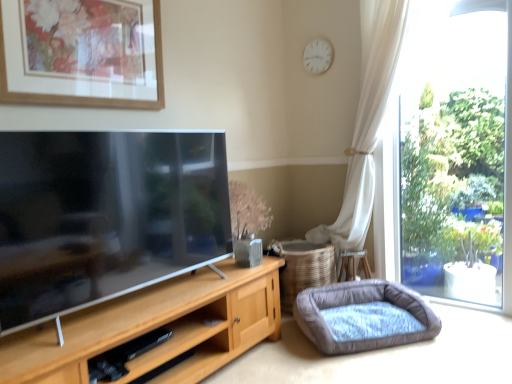
What do you see at coordinates (83, 96) in the screenshot? This screenshot has height=384, width=512. I see `matte wooden picture frame at upper left` at bounding box center [83, 96].

The image size is (512, 384). I want to click on white matte clock at upper center, so click(x=318, y=56).

Is point (37, 96) farther from viewer compared to point (316, 41)?

No, (37, 96) is closer to viewer.

How far apart are matte wooden picture frame at upper left and white matte clock at upper center?

A distance of 4.87 feet exists between matte wooden picture frame at upper left and white matte clock at upper center.

From the image's perspective, is matte wooden picture frame at upper left below white matte clock at upper center?

Correct, matte wooden picture frame at upper left appears lower than white matte clock at upper center in the image.

Does velvet grey dog bed at lower right touch white matte clock at upper center?

No, velvet grey dog bed at lower right is not next to white matte clock at upper center.

From a real-world perspective, which object rests below the other?

From a 3D spatial view, velvet grey dog bed at lower right is below.

From the image's perspective, is velvet grey dog bed at lower right located beneath white matte clock at upper center?

Yes, from the image's perspective, velvet grey dog bed at lower right is below white matte clock at upper center.

Can you confirm if white matte clock at upper center is wider than velvet grey dog bed at lower right?

No.

From the image's perspective, is white matte clock at upper center above velvet grey dog bed at lower right?

Indeed, from the image's perspective, white matte clock at upper center is shown above velvet grey dog bed at lower right.

Is white matte clock at upper center to the right of velvet grey dog bed at lower right from the viewer's perspective?

In fact, white matte clock at upper center is to the left of velvet grey dog bed at lower right.

From a real-world perspective, does white matte clock at upper center stand above velvet grey dog bed at lower right?

Indeed, from a real-world perspective, white matte clock at upper center stands above velvet grey dog bed at lower right.

Between white matte clock at upper center and matte wooden picture frame at upper left, which one appears on the left side from the viewer's perspective?

From the viewer's perspective, matte wooden picture frame at upper left appears more on the left side.

Can we say white matte clock at upper center lies outside matte wooden picture frame at upper left?

white matte clock at upper center is positioned outside matte wooden picture frame at upper left.

Is white matte clock at upper center wider or thinner than matte wooden picture frame at upper left?

Clearly, white matte clock at upper center has less width compared to matte wooden picture frame at upper left.

From the image's perspective, is velvet grey dog bed at lower right on matte wooden picture frame at upper left?

Actually, velvet grey dog bed at lower right appears below matte wooden picture frame at upper left in the image.

Considering the positions of objects velvet grey dog bed at lower right and matte wooden picture frame at upper left in the image provided, who is more to the left, velvet grey dog bed at lower right or matte wooden picture frame at upper left?

matte wooden picture frame at upper left.

From a real-world perspective, is velvet grey dog bed at lower right beneath matte wooden picture frame at upper left?

Yes, from a real-world perspective, velvet grey dog bed at lower right is beneath matte wooden picture frame at upper left.

Is velvet grey dog bed at lower right not close to matte wooden picture frame at upper left?

Yes, velvet grey dog bed at lower right and matte wooden picture frame at upper left are located far from each other.

How far apart are matte wooden picture frame at upper left and velvet grey dog bed at lower right?

The distance of matte wooden picture frame at upper left from velvet grey dog bed at lower right is 5.65 feet.

Is matte wooden picture frame at upper left aimed at velvet grey dog bed at lower right?

No, matte wooden picture frame at upper left is not facing towards velvet grey dog bed at lower right.

Considering the sizes of objects matte wooden picture frame at upper left and velvet grey dog bed at lower right in the image provided, who is smaller, matte wooden picture frame at upper left or velvet grey dog bed at lower right?

With smaller size is matte wooden picture frame at upper left.

Which is nearer, (85,106) or (384,343)?

Point (85,106) appears to be closer to the viewer than point (384,343).

Where is `picture frame located underneath the white matte clock at upper center (from a real-world perspective)`? The width and height of the screenshot is (512, 384). picture frame located underneath the white matte clock at upper center (from a real-world perspective) is located at coordinates (83, 96).

The width and height of the screenshot is (512, 384). I want to click on dog bed located on the right of white matte clock at upper center, so click(364, 316).

From the picture: Looking at the image, which one is located further to white matte clock at upper center, velvet grey dog bed at lower right or matte wooden picture frame at upper left?

Among the two, velvet grey dog bed at lower right is located further to white matte clock at upper center.

Estimate the real-world distances between objects in this image. Which object is further from white matte clock at upper center, matte wooden picture frame at upper left or velvet grey dog bed at lower right?

The object further to white matte clock at upper center is velvet grey dog bed at lower right.

When comparing their distances from velvet grey dog bed at lower right, does white matte clock at upper center or matte wooden picture frame at upper left seem further?

Among the two, white matte clock at upper center is located further to velvet grey dog bed at lower right.

Based on their spatial positions, is velvet grey dog bed at lower right or white matte clock at upper center closer to matte wooden picture frame at upper left?

white matte clock at upper center is closer to matte wooden picture frame at upper left.

From the picture: Which object lies nearer to the anchor point velvet grey dog bed at lower right, matte wooden picture frame at upper left or white matte clock at upper center?

matte wooden picture frame at upper left is closer to velvet grey dog bed at lower right.

Based on the photo, considering their positions, is white matte clock at upper center positioned closer to matte wooden picture frame at upper left than velvet grey dog bed at lower right?

white matte clock at upper center is positioned closer to the anchor matte wooden picture frame at upper left.

Find the location of a particular element. The width and height of the screenshot is (512, 384). picture frame between white matte clock at upper center and velvet grey dog bed at lower right from top to bottom is located at coordinates (83, 96).